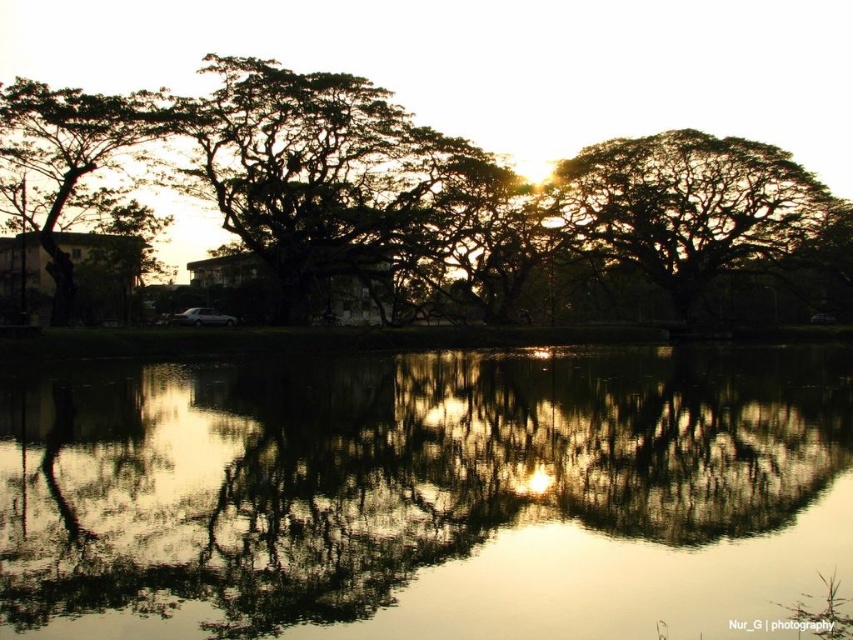
Is silhouette leafy tree at center below dark green leafy tree at left?

Incorrect, silhouette leafy tree at center is not positioned below dark green leafy tree at left.

Is point (262, 216) in front of point (80, 163)?

No, (262, 216) is further to viewer.

Does point (376, 115) come behind point (88, 150)?

Yes, it is.

Where is `silhouette leafy tree at center`? silhouette leafy tree at center is located at coordinates (409, 189).

Based on the photo, can you confirm if dark green leafy tree at center is bigger than dark green leafy tree at left?

Indeed, dark green leafy tree at center has a larger size compared to dark green leafy tree at left.

Can you confirm if dark green leafy tree at center is positioned below dark green leafy tree at left?

No, dark green leafy tree at center is not below dark green leafy tree at left.

Where is `dark green leafy tree at center`? dark green leafy tree at center is located at coordinates (328, 173).

Is dark green leafy tree at center to the right of dark green leafy tree at upper right from the viewer's perspective?

In fact, dark green leafy tree at center is to the left of dark green leafy tree at upper right.

Who is more forward, (242, 228) or (596, 168)?

Point (242, 228) is in front.

Measure the distance between point (311, 221) and camera.

The distance of point (311, 221) from camera is 66.24 meters.

Locate an element on the screen. dark green leafy tree at center is located at coordinates (328, 173).